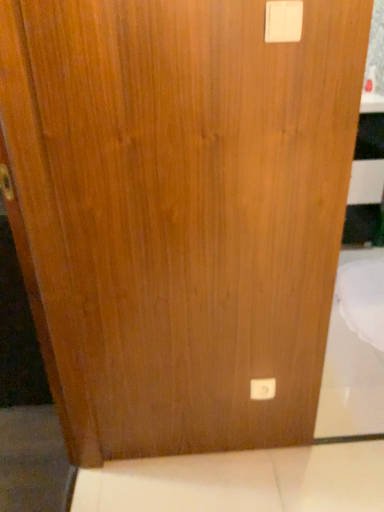
You are a GUI agent. You are given a task and a screenshot of the screen. Output one action in this format:
    pyautogui.click(x=<x>, y=<y>)
    Task: Click on the white plastic light switch at lower center, arranged as the first light switch when viewed from the back
    This screenshot has height=512, width=384.
    Given the screenshot: What is the action you would take?
    pyautogui.click(x=262, y=389)

The width and height of the screenshot is (384, 512). What do you see at coordinates (262, 389) in the screenshot? I see `white plastic light switch at lower center, the second light switch from the top` at bounding box center [262, 389].

What is the approximate width of white plastic light switch at upper right, marked as the 2th light switch in a back-to-front arrangement?

white plastic light switch at upper right, marked as the 2th light switch in a back-to-front arrangement, is 0.90 inches wide.

The width and height of the screenshot is (384, 512). What are the coordinates of `white plastic light switch at upper right, which ranks as the 1th light switch in front-to-back order` in the screenshot? It's located at (283, 21).

How much space does white plastic light switch at upper right, marked as the 2th light switch in a back-to-front arrangement, occupy vertically?

white plastic light switch at upper right, marked as the 2th light switch in a back-to-front arrangement, is 3.21 inches tall.

What do you see at coordinates (283, 21) in the screenshot?
I see `white plastic light switch at upper right, which ranks as the 1th light switch in front-to-back order` at bounding box center [283, 21].

At what (x,y) coordinates should I click in order to perform the action: click on white plastic light switch at lower center, marked as the 1th light switch in a bottom-to-top arrangement. Please return your answer as a coordinate pair (x, y). The width and height of the screenshot is (384, 512). Looking at the image, I should click on (262, 389).

Between white plastic light switch at lower center, the second light switch from the top, and white plastic light switch at upper right, marked as the 2th light switch in a back-to-front arrangement, which one appears on the left side from the viewer's perspective?

From the viewer's perspective, white plastic light switch at upper right, marked as the 2th light switch in a back-to-front arrangement, appears more on the left side.

Considering the relative positions of white plastic light switch at lower center, marked as the 1th light switch in a bottom-to-top arrangement, and white plastic light switch at upper right, marked as the 2th light switch in a back-to-front arrangement, in the image provided, is white plastic light switch at lower center, marked as the 1th light switch in a bottom-to-top arrangement, behind white plastic light switch at upper right, marked as the 2th light switch in a back-to-front arrangement,?

Yes.

Does point (267, 378) lie behind point (278, 39)?

Yes, it is behind point (278, 39).

From the image's perspective, is white plastic light switch at lower center, arranged as the first light switch when viewed from the back, positioned above or below white plastic light switch at upper right, which is counted as the 2th light switch, starting from the bottom?

Clearly, from the image's perspective, white plastic light switch at lower center, arranged as the first light switch when viewed from the back, is below white plastic light switch at upper right, which is counted as the 2th light switch, starting from the bottom.

From a real-world perspective, is white plastic light switch at lower center, the second light switch from the top, positioned under white plastic light switch at upper right, marked as the first light switch in a top-to-bottom arrangement, based on gravity?

Correct, in the physical world, white plastic light switch at lower center, the second light switch from the top, is lower than white plastic light switch at upper right, marked as the first light switch in a top-to-bottom arrangement.

Which object is wider, white plastic light switch at lower center, arranged as the first light switch when viewed from the back, or white plastic light switch at upper right, which ranks as the 1th light switch in front-to-back order?

white plastic light switch at upper right, which ranks as the 1th light switch in front-to-back order, is wider.

Can you confirm if white plastic light switch at lower center, the second light switch from the front, is shorter than white plastic light switch at upper right, which is counted as the 2th light switch, starting from the bottom?

In fact, white plastic light switch at lower center, the second light switch from the front, may be taller than white plastic light switch at upper right, which is counted as the 2th light switch, starting from the bottom.

Which of these two, white plastic light switch at lower center, marked as the 1th light switch in a bottom-to-top arrangement, or white plastic light switch at upper right, which ranks as the 1th light switch in front-to-back order, is bigger?

Bigger between the two is white plastic light switch at lower center, marked as the 1th light switch in a bottom-to-top arrangement.

Is white plastic light switch at lower center, the second light switch from the front, not within white plastic light switch at upper right, marked as the 2th light switch in a back-to-front arrangement?

Yes, white plastic light switch at lower center, the second light switch from the front, is not within white plastic light switch at upper right, marked as the 2th light switch in a back-to-front arrangement.

Are white plastic light switch at lower center, the second light switch from the front, and white plastic light switch at upper right, marked as the 2th light switch in a back-to-front arrangement, beside each other?

No, white plastic light switch at lower center, the second light switch from the front, is not making contact with white plastic light switch at upper right, marked as the 2th light switch in a back-to-front arrangement.

Is white plastic light switch at lower center, the second light switch from the top, looking in the opposite direction of white plastic light switch at upper right, marked as the 2th light switch in a back-to-front arrangement?

No.

Can you tell me how much white plastic light switch at lower center, the second light switch from the front, and white plastic light switch at upper right, marked as the 2th light switch in a back-to-front arrangement, differ in facing direction?

The angular difference between white plastic light switch at lower center, the second light switch from the front, and white plastic light switch at upper right, marked as the 2th light switch in a back-to-front arrangement, is 1.32 degrees.

The width and height of the screenshot is (384, 512). In order to click on light switch located below the white plastic light switch at upper right, which is counted as the 2th light switch, starting from the bottom (from the image's perspective) in this screenshot , I will do `click(262, 389)`.

Between white plastic light switch at upper right, marked as the 2th light switch in a back-to-front arrangement, and white plastic light switch at lower center, the second light switch from the top, which one appears on the left side from the viewer's perspective?

white plastic light switch at upper right, marked as the 2th light switch in a back-to-front arrangement, is more to the left.

Which object is closer to the camera taking this photo, white plastic light switch at upper right, marked as the first light switch in a top-to-bottom arrangement, or white plastic light switch at lower center, the second light switch from the front?

white plastic light switch at upper right, marked as the first light switch in a top-to-bottom arrangement, is closer to the camera.

Which point is more forward, (297, 26) or (272, 387)?

The point (297, 26) is in front.

From the image's perspective, is white plastic light switch at upper right, marked as the first light switch in a top-to-bottom arrangement, located above or below white plastic light switch at lower center, marked as the 1th light switch in a bottom-to-top arrangement?

Clearly, from the image's perspective, white plastic light switch at upper right, marked as the first light switch in a top-to-bottom arrangement, is above white plastic light switch at lower center, marked as the 1th light switch in a bottom-to-top arrangement.

From a real-world perspective, is white plastic light switch at upper right, which is counted as the 2th light switch, starting from the bottom, positioned over white plastic light switch at lower center, arranged as the first light switch when viewed from the back, based on gravity?

Indeed, from a real-world perspective, white plastic light switch at upper right, which is counted as the 2th light switch, starting from the bottom, stands above white plastic light switch at lower center, arranged as the first light switch when viewed from the back.

In the scene shown: Can you confirm if white plastic light switch at upper right, marked as the first light switch in a top-to-bottom arrangement, is thinner than white plastic light switch at lower center, the second light switch from the top?

Incorrect, the width of white plastic light switch at upper right, marked as the first light switch in a top-to-bottom arrangement, is not less than that of white plastic light switch at lower center, the second light switch from the top.

Considering the sizes of objects white plastic light switch at upper right, which ranks as the 1th light switch in front-to-back order, and white plastic light switch at lower center, arranged as the first light switch when viewed from the back, in the image provided, who is taller, white plastic light switch at upper right, which ranks as the 1th light switch in front-to-back order, or white plastic light switch at lower center, arranged as the first light switch when viewed from the back,?

With more height is white plastic light switch at lower center, arranged as the first light switch when viewed from the back.

Between white plastic light switch at upper right, marked as the first light switch in a top-to-bottom arrangement, and white plastic light switch at lower center, the second light switch from the top, which one has larger size?

With larger size is white plastic light switch at lower center, the second light switch from the top.

Is white plastic light switch at upper right, which ranks as the 1th light switch in front-to-back order, situated inside white plastic light switch at lower center, marked as the 1th light switch in a bottom-to-top arrangement, or outside?

white plastic light switch at upper right, which ranks as the 1th light switch in front-to-back order, is spatially situated outside white plastic light switch at lower center, marked as the 1th light switch in a bottom-to-top arrangement.

Is white plastic light switch at upper right, marked as the first light switch in a top-to-bottom arrangement, placed right next to white plastic light switch at lower center, the second light switch from the front?

They are not placed beside each other.

Is white plastic light switch at upper right, marked as the first light switch in a top-to-bottom arrangement, oriented away from white plastic light switch at lower center, marked as the 1th light switch in a bottom-to-top arrangement?

No, white plastic light switch at upper right, marked as the first light switch in a top-to-bottom arrangement, is not facing the opposite direction of white plastic light switch at lower center, marked as the 1th light switch in a bottom-to-top arrangement.

At what (x,y) coordinates should I click in order to perform the action: click on light switch in front of the white plastic light switch at lower center, marked as the 1th light switch in a bottom-to-top arrangement. Please return your answer as a coordinate pair (x, y). Image resolution: width=384 pixels, height=512 pixels. Looking at the image, I should click on (283, 21).

Identify the location of light switch that is above the white plastic light switch at lower center, the second light switch from the top (from the image's perspective). (283, 21).

This screenshot has width=384, height=512. I want to click on light switch that appears on the right of white plastic light switch at upper right, marked as the 2th light switch in a back-to-front arrangement, so click(x=262, y=389).